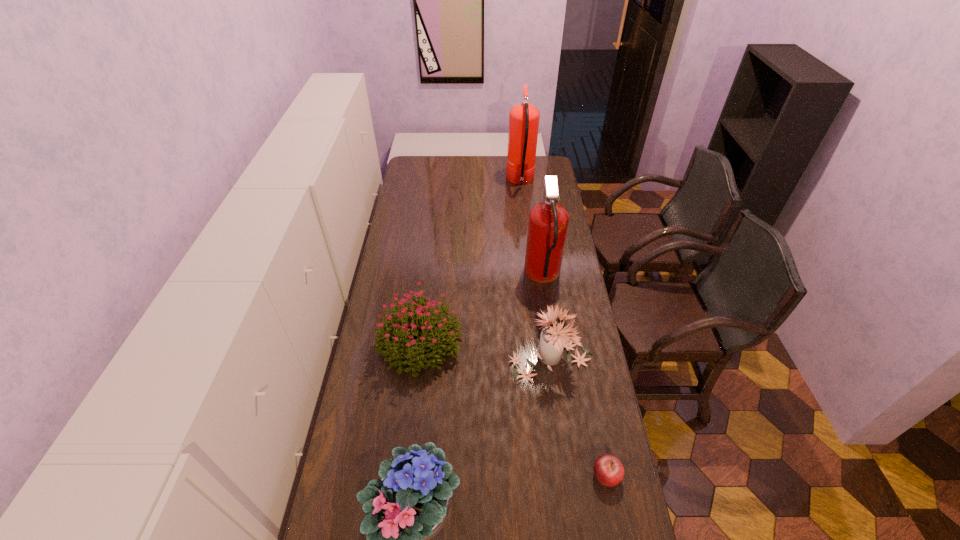
Locate an element on the screen. The height and width of the screenshot is (540, 960). free space in the image that satisfies the following two spatial constraints: 1. with the handle and nozzle on the nearer fire extinguisher; 2. on the front side of the rightmost bouquet is located at coordinates (555, 358).

Where is `free location that satisfies the following two spatial constraints: 1. on the front side of the rightmost bouquet; 2. on the right side of the apple`? free location that satisfies the following two spatial constraints: 1. on the front side of the rightmost bouquet; 2. on the right side of the apple is located at coordinates (565, 475).

Where is `vacant space that satisfies the following two spatial constraints: 1. on the back side of the apple; 2. with the handle and nozzle on the nearer fire extinguisher`? Image resolution: width=960 pixels, height=540 pixels. vacant space that satisfies the following two spatial constraints: 1. on the back side of the apple; 2. with the handle and nozzle on the nearer fire extinguisher is located at coordinates (567, 276).

The image size is (960, 540). What are the coordinates of `free location that satisfies the following two spatial constraints: 1. on the back side of the shortest object; 2. towards the nozzle of the farthest object` in the screenshot? It's located at (548, 181).

At what (x,y) coordinates should I click in order to perform the action: click on free location that satisfies the following two spatial constraints: 1. towards the nozzle of the apple; 2. on the right side of the farther fire extinguisher. Please return your answer as a coordinate pair (x, y). Looking at the image, I should click on (555, 475).

The image size is (960, 540). I want to click on free space that satisfies the following two spatial constraints: 1. towards the nozzle of the apple; 2. on the left side of the farthest object, so click(x=555, y=475).